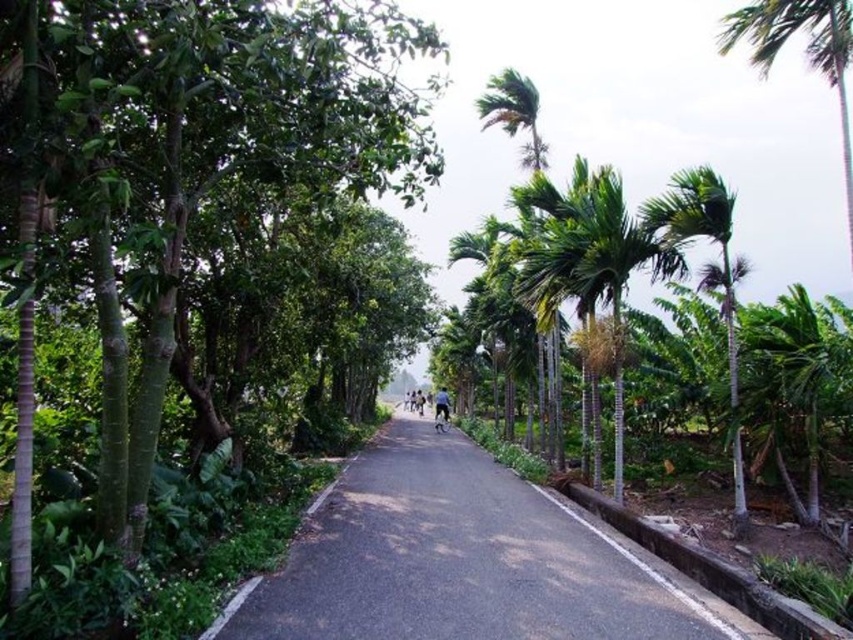
You are a delivery driver planning to drive a truck that is 2.5 meters wide along the black asphalt road at center. Considering the road width mentioned in the scene description, can you safely navigate the road without hitting the green leafy palm tree at upper right?

The black asphalt road at center is narrower than the green leafy palm tree at upper right. Since the road is narrower than the truck width of 2.5 meters, it is not safe to navigate without risking a collision with the green leafy palm tree at upper right.

You are standing at the starting point of the road and want to reach the green leafy tree at center. Which direction should you move in relation to the road?

The green leafy tree at center is located at the center of the image, so you should move forward along the road towards the middle area to reach it.

You are standing at point (463, 561) in the image. What is the object directly beneath you?

The object directly beneath you at point (463, 561) is the black asphalt road at center.